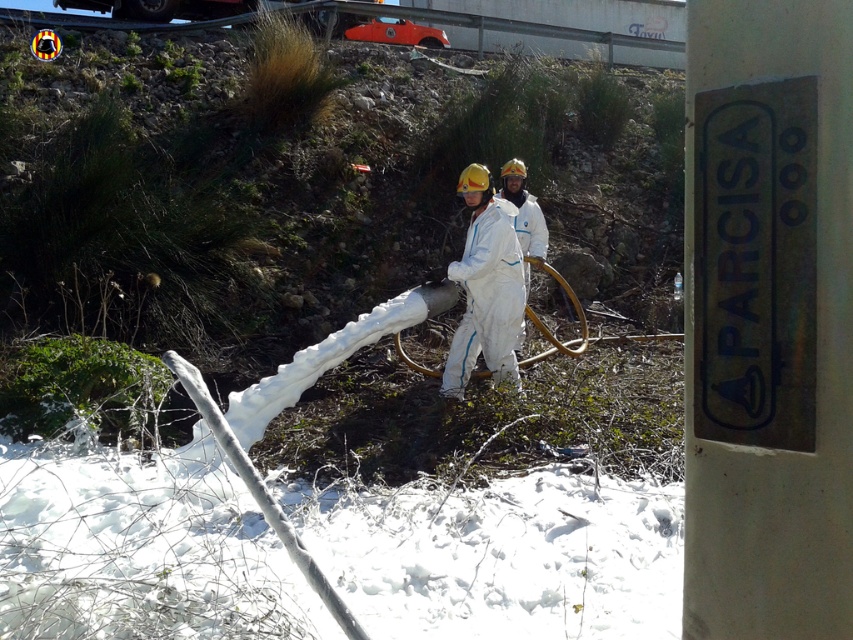
Does white metal sign at right appear over white matte suit at center?

No, white metal sign at right is not above white matte suit at center.

Who is taller, white metal sign at right or white matte suit at center?

white matte suit at center is taller.

I want to click on white metal sign at right, so click(769, 317).